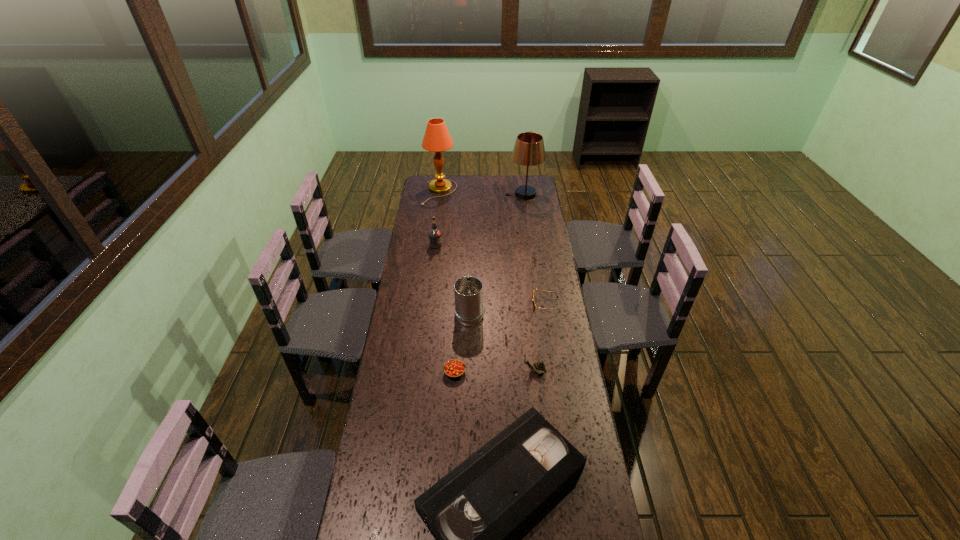
Identify the location of lamp. The image size is (960, 540). (436, 139).

This screenshot has height=540, width=960. I want to click on lampshade, so click(529, 150).

Where is `vodka`? The width and height of the screenshot is (960, 540). vodka is located at coordinates (435, 235).

Identify the location of mug. This screenshot has width=960, height=540. (468, 290).

Image resolution: width=960 pixels, height=540 pixels. I want to click on the fourth shortest object, so click(539, 367).

The height and width of the screenshot is (540, 960). In order to click on strawberry in this screenshot , I will do pos(454,368).

I want to click on sunglasses, so click(x=534, y=305).

Locate an element on the screen. This screenshot has width=960, height=540. free point located 0.390m on the front of the lamp is located at coordinates (433, 248).

You are a GUI agent. You are given a task and a screenshot of the screen. Output one action in this format:
    pyautogui.click(x=<x>, y=<y>)
    Task: Click on the free space located on the front-facing side of the lampshade
    This screenshot has height=540, width=960.
    Given the screenshot: What is the action you would take?
    pos(494,194)

The height and width of the screenshot is (540, 960). I want to click on free spot located on the front-facing side of the lampshade, so click(x=450, y=194).